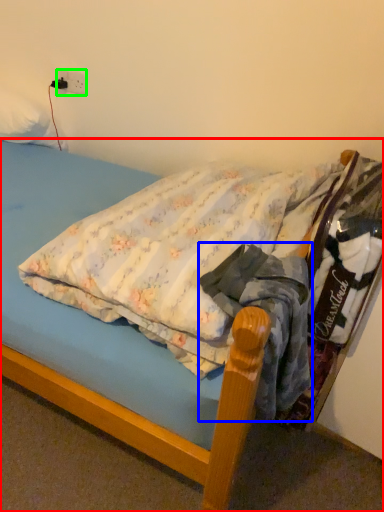
Question: Which object is positioned farthest from bed (highlighted by a red box)? Select from clothing (highlighted by a blue box) and electric outlet (highlighted by a green box).

Choices:
 (A) clothing
 (B) electric outlet

Answer: (B)